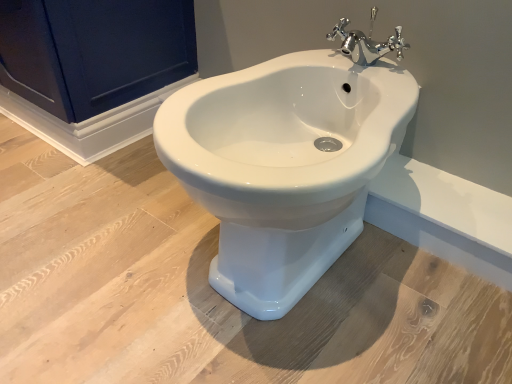
What are the coordinates of `vacant space situated on the left part of chrome metallic faucet at upper center` in the screenshot? It's located at (282, 64).